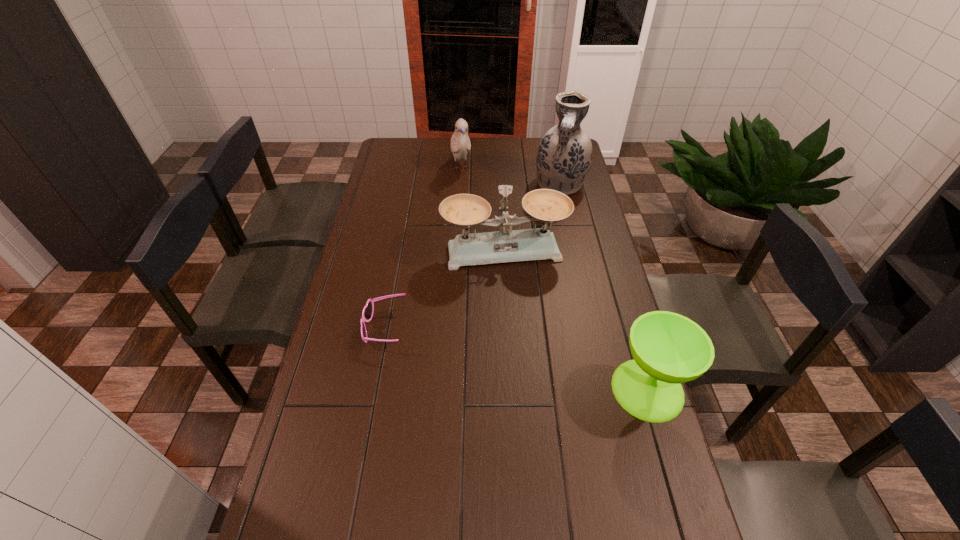
Locate an element on the screen. This screenshot has width=960, height=540. vacant space on the desktop that is between the shortest object and the wineglass and is positioned with the handle on the side of the tallest object is located at coordinates (528, 362).

Where is `vacant space on the desktop that is between the sunglasses and the nearest object and is positioned on the front-facing side of the third nearest object`? This screenshot has height=540, width=960. vacant space on the desktop that is between the sunglasses and the nearest object and is positioned on the front-facing side of the third nearest object is located at coordinates (530, 362).

In order to click on free spot on the desktop that is between the shortest object and the second shortest object and is positioned at the beak of the bird in this screenshot , I will do `click(521, 360)`.